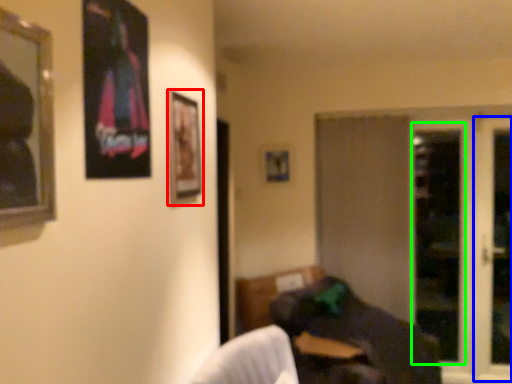
Question: Estimate the real-world distances between objects in this image. Which object is farther from picture frame (highlighted by a red box), screen door (highlighted by a blue box) or screen door (highlighted by a green box)?

Choices:
 (A) screen door
 (B) screen door

Answer: (A)